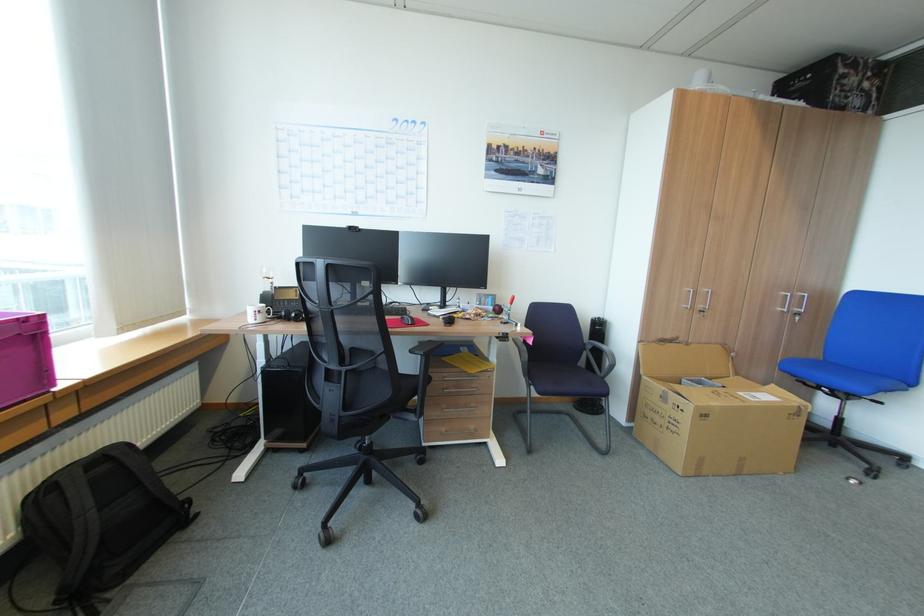
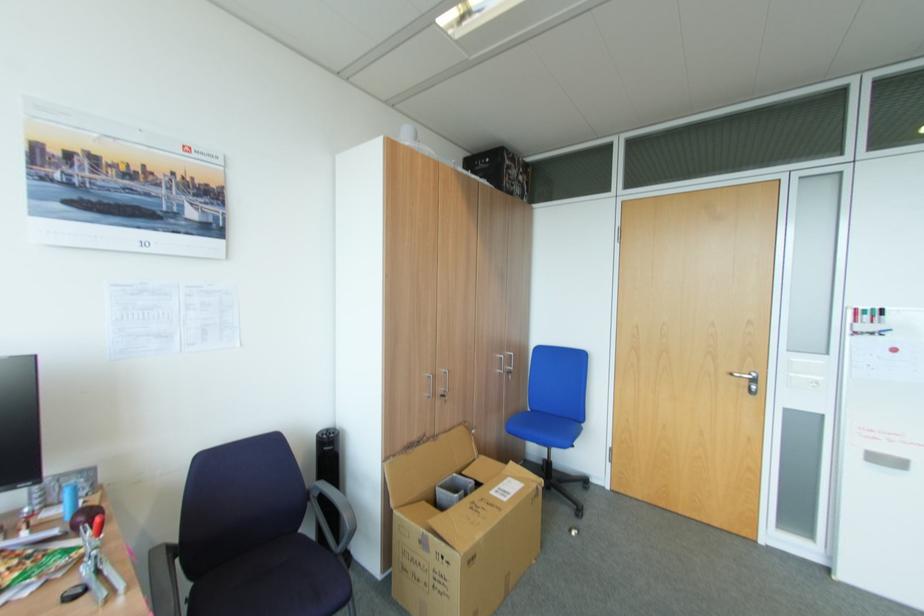
Where in the second image is the point corresponding to the point at 786,370 from the first image?

(515, 431)